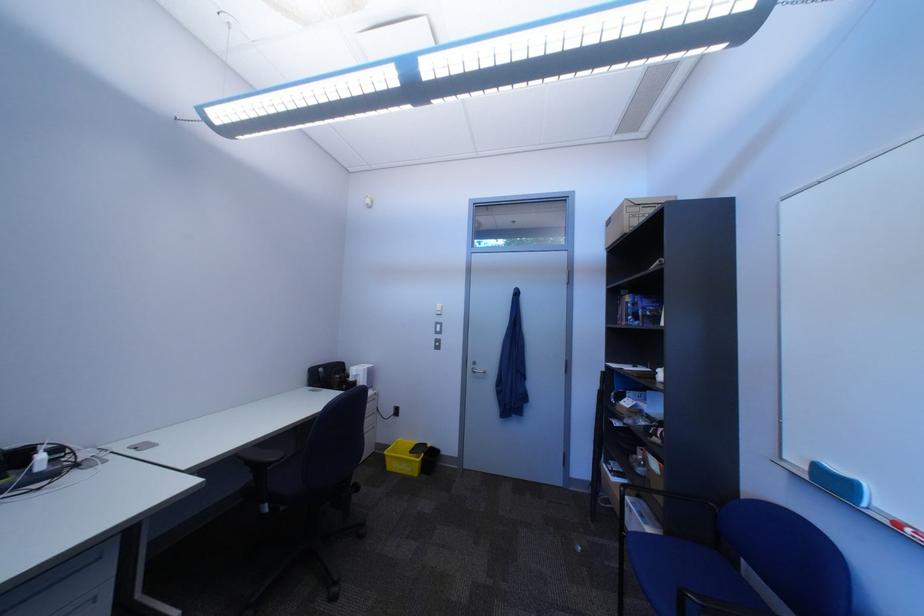
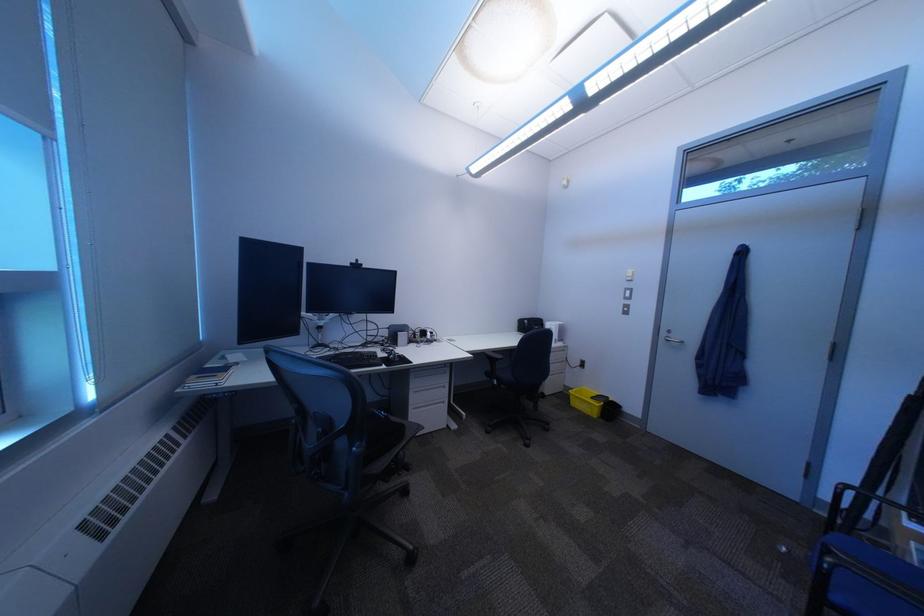
Question: The first image is from the beginning of the video and the second image is from the end. How did the camera likely rotate when shooting the video?

Choices:
 (A) Left
 (B) Right
 (C) Up
 (D) Down

Answer: (A)